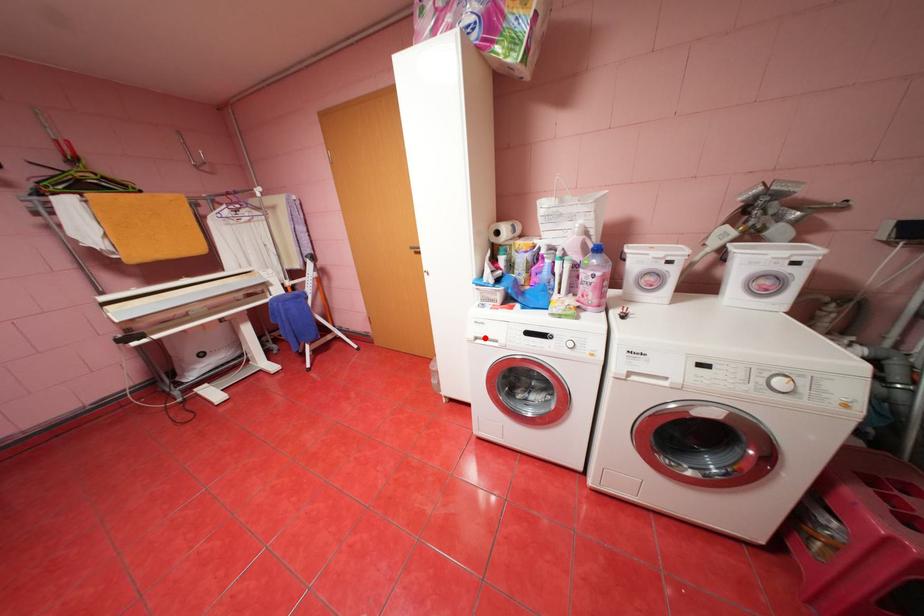
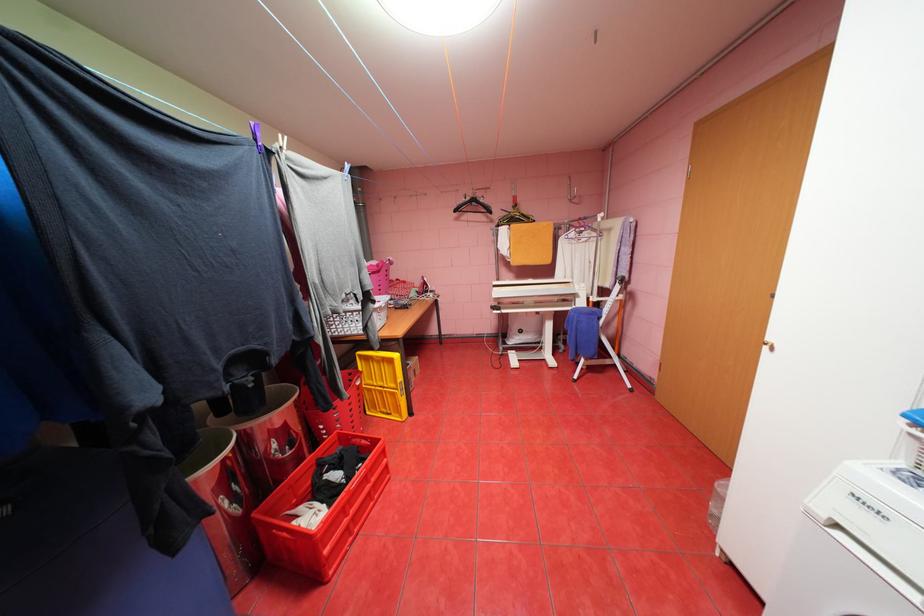
Find the pixel in the second image that matches the highlighted location in the first image.

(845, 525)